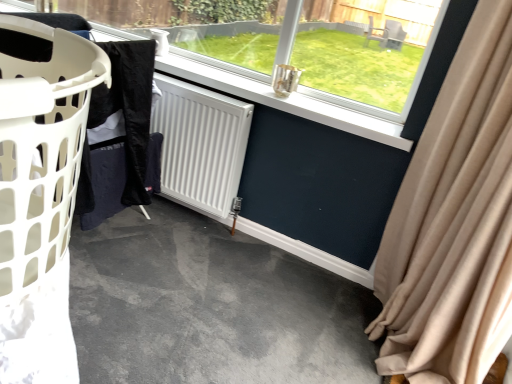
In order to face beige fabric curtain at right, should I rotate leftwards or rightwards?

Rotate your view right by about 28.613°.

This screenshot has height=384, width=512. Describe the element at coordinates (454, 222) in the screenshot. I see `beige fabric curtain at right` at that location.

Locate an element on the screen. This screenshot has width=512, height=384. gray concrete floor at lower left is located at coordinates (210, 307).

What is the approximate width of black fabric at left?

black fabric at left is 2.19 inches wide.

Locate an element on the screen. The image size is (512, 384). white matte radiator at center is located at coordinates (200, 144).

Measure the distance between point (x=212, y=99) and camera.

The distance of point (x=212, y=99) from camera is 6.55 feet.

At what (x,y) coordinates should I click in order to perform the action: click on beige fabric curtain at right. Please return your answer as a coordinate pair (x, y). The image size is (512, 384). Looking at the image, I should click on (454, 222).

Does black fabric at left touch white plastic laundry basket at left?

No, black fabric at left is not with white plastic laundry basket at left.

Between black fabric at left and white plastic laundry basket at left, which one has larger width?

With larger width is white plastic laundry basket at left.

Based on the photo, can you tell me how much black fabric at left and white plastic laundry basket at left differ in facing direction?

The facing directions of black fabric at left and white plastic laundry basket at left are 89.7 degrees apart.

From a real-world perspective, is black fabric at left positioned over white plastic laundry basket at left based on gravity?

No, from a real-world perspective, black fabric at left is not over white plastic laundry basket at left

Considering the sizes of gray concrete floor at lower left and beige fabric curtain at right in the image, is gray concrete floor at lower left taller or shorter than beige fabric curtain at right?

gray concrete floor at lower left is shorter than beige fabric curtain at right.

Could you tell me if gray concrete floor at lower left is facing beige fabric curtain at right?

No, gray concrete floor at lower left does not turn towards beige fabric curtain at right.

Does gray concrete floor at lower left appear on the left side of beige fabric curtain at right?

Correct, you'll find gray concrete floor at lower left to the left of beige fabric curtain at right.

In order to click on concrete behind the beige fabric curtain at right in this screenshot , I will do `click(210, 307)`.

Between beige fabric curtain at right and gray concrete floor at lower left, which one has less height?

With less height is gray concrete floor at lower left.

Can you confirm if beige fabric curtain at right is smaller than gray concrete floor at lower left?

Actually, beige fabric curtain at right might be larger than gray concrete floor at lower left.

Which of these two, beige fabric curtain at right or gray concrete floor at lower left, is wider?

gray concrete floor at lower left.

From the image's perspective, is beige fabric curtain at right located above or below gray concrete floor at lower left?

From the image's perspective, beige fabric curtain at right appears above gray concrete floor at lower left.

From the image's perspective, is white plastic laundry basket at left below transparent glass window at center?

Yes, from the image's perspective, white plastic laundry basket at left is below transparent glass window at center.

Between white plastic laundry basket at left and transparent glass window at center, which one is positioned behind?

transparent glass window at center is more distant.

Between white plastic laundry basket at left and transparent glass window at center, which one has smaller width?

With smaller width is transparent glass window at center.

From a real-world perspective, is white plastic laundry basket at left positioned above or below transparent glass window at center?

Clearly, from a real-world perspective, white plastic laundry basket at left is above transparent glass window at center.

Between point (469, 147) and point (163, 92), which one is positioned in front?

The point (469, 147) is closer to the camera.

Considering their positions, is beige fabric curtain at right located in front of or behind white matte radiator at center?

beige fabric curtain at right is in front of white matte radiator at center.

Measure the distance from beige fabric curtain at right to white matte radiator at center.

beige fabric curtain at right and white matte radiator at center are 99.56 centimeters apart.

Is beige fabric curtain at right aimed at white matte radiator at center?

Yes, beige fabric curtain at right is aimed at white matte radiator at center.

Does gray concrete floor at lower left appear on the left side of white matte radiator at center?

In fact, gray concrete floor at lower left is to the right of white matte radiator at center.

Is there a large distance between gray concrete floor at lower left and white matte radiator at center?

No, gray concrete floor at lower left is not far away from white matte radiator at center.

In terms of size, does gray concrete floor at lower left appear bigger or smaller than white matte radiator at center?

Considering their sizes, gray concrete floor at lower left takes up more space than white matte radiator at center.

In terms of width, does gray concrete floor at lower left look wider or thinner when compared to white matte radiator at center?

Clearly, gray concrete floor at lower left has more width compared to white matte radiator at center.

Looking at this image, could you tell me if transparent glass window at center is facing beige fabric curtain at right?

No, transparent glass window at center is not aimed at beige fabric curtain at right.

Between transparent glass window at center and beige fabric curtain at right, which one is positioned in front?

Positioned in front is beige fabric curtain at right.

From a real-world perspective, which is physically above, transparent glass window at center or beige fabric curtain at right?

transparent glass window at center.

Considering the relative positions of transparent glass window at center and beige fabric curtain at right in the image provided, is transparent glass window at center to the left or to the right of beige fabric curtain at right?

transparent glass window at center is to the left of beige fabric curtain at right.

Locate an element on the screen. The width and height of the screenshot is (512, 384). furniture in front of the black fabric at left is located at coordinates (41, 199).

This screenshot has width=512, height=384. What are the coordinates of `concrete on the left of beige fabric curtain at right` in the screenshot? It's located at (210, 307).

Estimate the real-world distances between objects in this image. Which object is closer to white matte radiator at center, white plastic laundry basket at left or gray concrete floor at lower left?

gray concrete floor at lower left.

Considering their positions, is beige fabric curtain at right positioned further to white matte radiator at center than gray concrete floor at lower left?

beige fabric curtain at right lies further to white matte radiator at center than the other object.

Which object lies nearer to the anchor point transparent glass window at center, beige fabric curtain at right or gray concrete floor at lower left?

beige fabric curtain at right lies closer to transparent glass window at center than the other object.

When comparing their distances from transparent glass window at center, does black fabric at left or white plastic laundry basket at left seem further?

white plastic laundry basket at left.

When comparing their distances from transparent glass window at center, does white plastic laundry basket at left or white matte radiator at center seem closer?

white matte radiator at center is positioned closer to the anchor transparent glass window at center.

Which object lies further to the anchor point transparent glass window at center, black fabric at left or white matte radiator at center?

The object further to transparent glass window at center is black fabric at left.

Looking at the image, which one is located closer to white matte radiator at center, beige fabric curtain at right or white plastic laundry basket at left?

Based on the image, beige fabric curtain at right appears to be nearer to white matte radiator at center.

Looking at the image, which one is located closer to beige fabric curtain at right, white matte radiator at center or transparent glass window at center?

The object closer to beige fabric curtain at right is transparent glass window at center.

Find the location of `clothing between transparent glass window at center and white matte radiator at center in the vertical direction`. clothing between transparent glass window at center and white matte radiator at center in the vertical direction is located at coordinates (121, 137).

You are a GUI agent. You are given a task and a screenshot of the screen. Output one action in this format:
    pyautogui.click(x=<x>, y=<y>)
    Task: Click on the concrete located between white plastic laundry basket at left and transparent glass window at center in the depth direction
    The image size is (512, 384).
    Given the screenshot: What is the action you would take?
    pyautogui.click(x=210, y=307)

This screenshot has width=512, height=384. I want to click on concrete located between black fabric at left and beige fabric curtain at right in the left-right direction, so click(210, 307).

The image size is (512, 384). What are the coordinates of `clothing that lies between transparent glass window at center and gray concrete floor at lower left from top to bottom` in the screenshot? It's located at [121, 137].